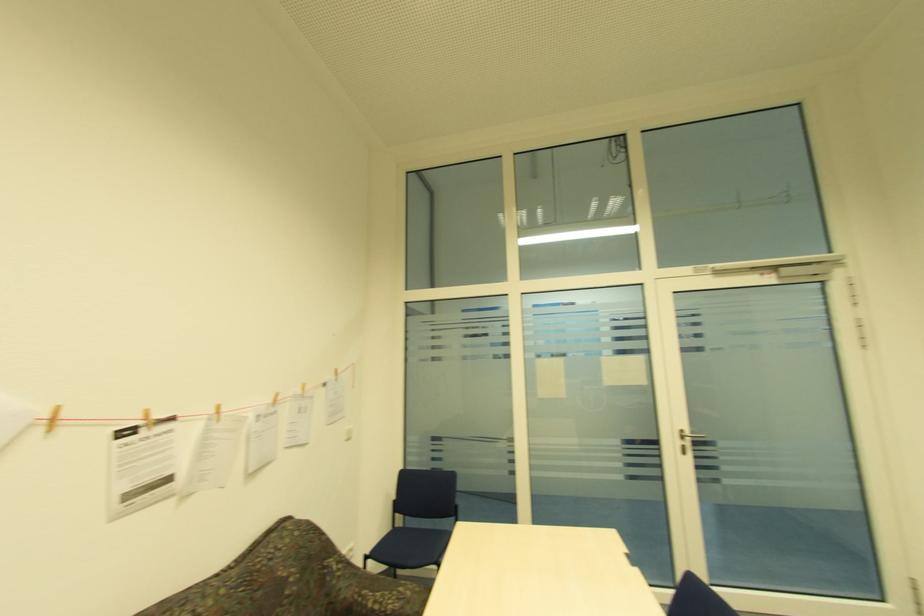
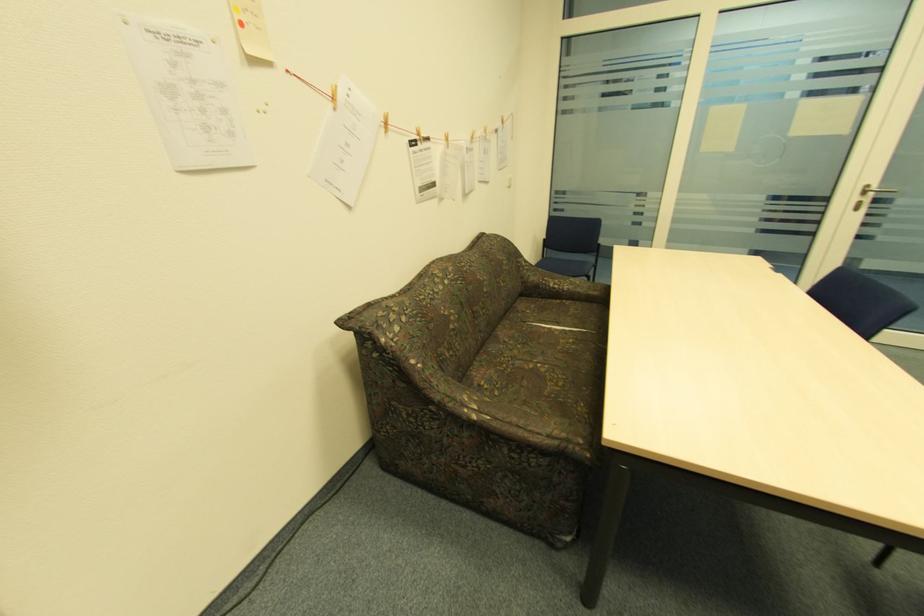
Find the pixel in the second image that matches (685,432) in the first image.

(870, 187)